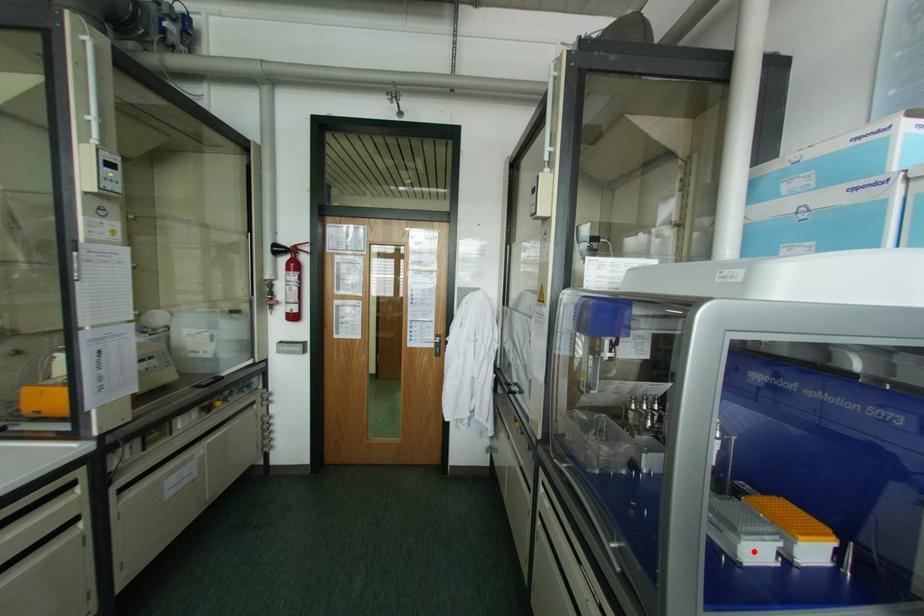
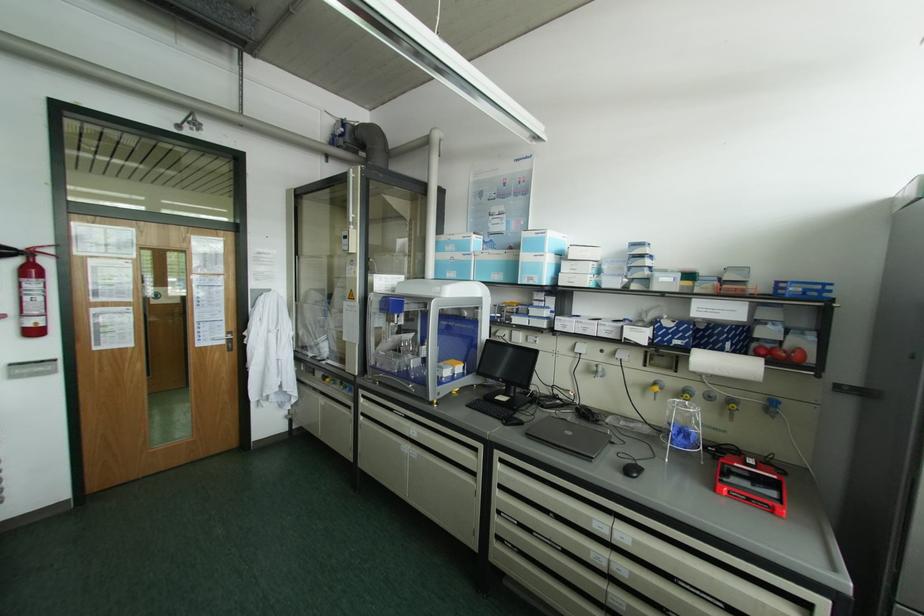
In the second image, find the point that corresponds to the highlighted location in the first image.

(445, 371)